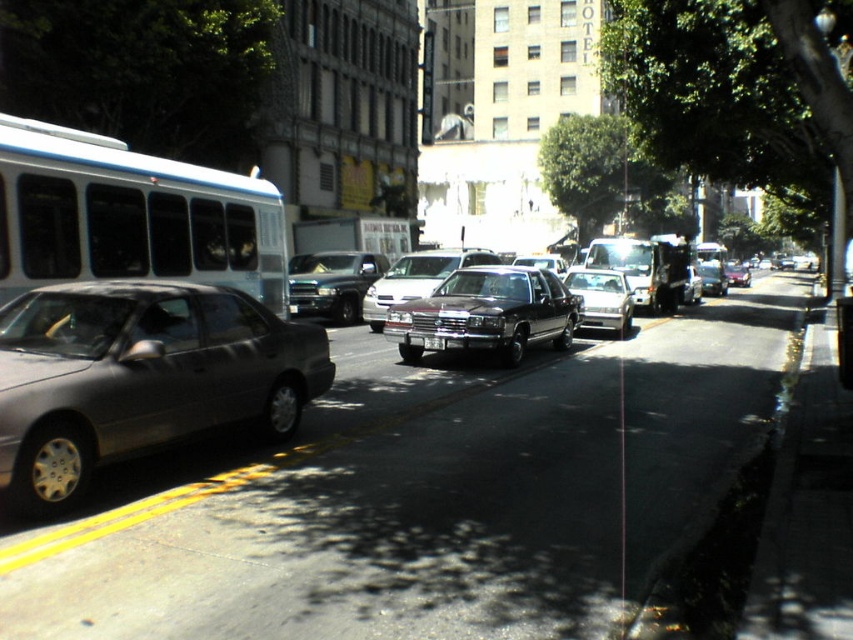
Can you confirm if satin silver sedan at left is positioned below white matte bus at left?

Yes, satin silver sedan at left is below white matte bus at left.

Which is more to the right, satin silver sedan at left or white matte bus at left?

Positioned to the right is satin silver sedan at left.

Locate an element on the screen. This screenshot has width=853, height=640. satin silver sedan at left is located at coordinates (138, 378).

Is white matte bus at left wider than shiny dark brown sedan at center?

In fact, white matte bus at left might be narrower than shiny dark brown sedan at center.

Between point (142, 228) and point (415, 305), which one is positioned in front?

Point (142, 228) is more forward.

Who is more forward, (142, 216) or (412, 321)?

Point (142, 216) is in front.

Find the location of `white matte bus at left`. white matte bus at left is located at coordinates (131, 216).

Is shiny dark brown sedan at center to the left of shiny black truck at center from the viewer's perspective?

No, shiny dark brown sedan at center is not to the left of shiny black truck at center.

You are a GUI agent. You are given a task and a screenshot of the screen. Output one action in this format:
    pyautogui.click(x=<x>, y=<y>)
    Task: Click on the shiny dark brown sedan at center
    The image size is (853, 640).
    Given the screenshot: What is the action you would take?
    pyautogui.click(x=486, y=314)

At what (x,y) coordinates should I click in order to perform the action: click on shiny dark brown sedan at center. Please return your answer as a coordinate pair (x, y). The image size is (853, 640). Looking at the image, I should click on (486, 314).